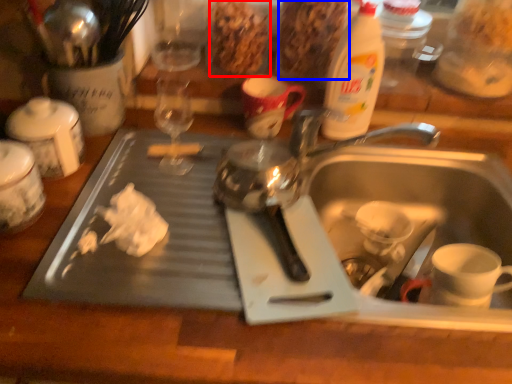
Question: Which point is closer to the camera, food (highlighted by a red box) or food (highlighted by a blue box)?

Choices:
 (A) food
 (B) food

Answer: (B)